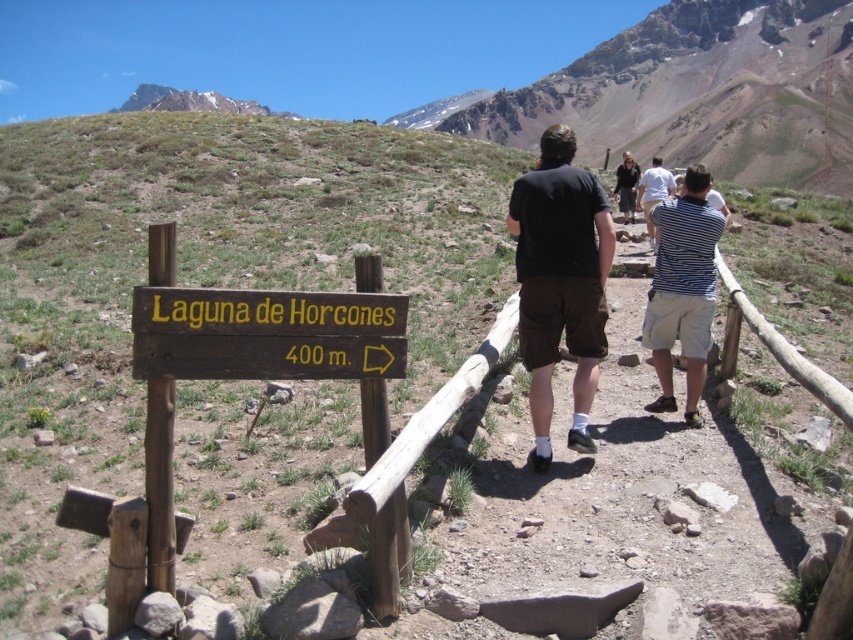
Looking at this image, you are a hiker planning to take a photo of the rugged brown rock formation at upper center and the brown wooden sign at lower left. Which object should you move closer to in order to capture both in the same frame?

The rugged brown rock formation at upper center is wider than the brown wooden sign at lower left. To capture both in the same frame, you should move closer to the rugged brown rock formation at upper center so that both objects appear within the camera view.

You are a hiker standing at the trailhead and see the rugged brown rock formation at upper center and the brown wooden sign at lower left. Which object is closer to you?

The brown wooden sign at lower left is closer to you because it is positioned in front of the rugged brown rock formation at upper center, which is further away.